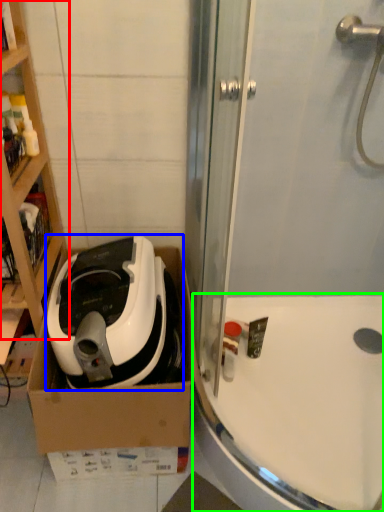
Question: Based on their relative distances, which object is nearer to cabinetry (highlighted by a red box)? Choose from home appliance (highlighted by a blue box) and bath (highlighted by a green box).

Choices:
 (A) home appliance
 (B) bath

Answer: (A)